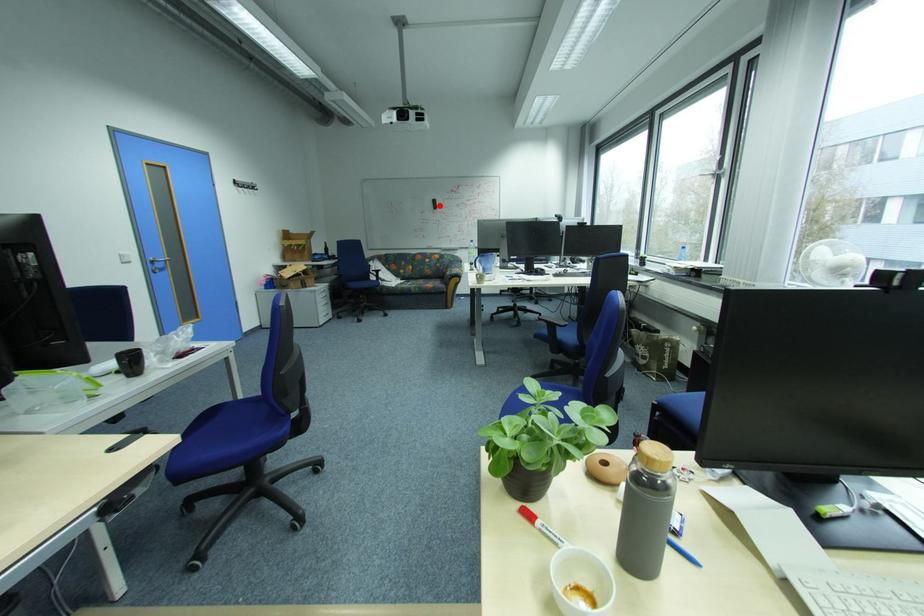
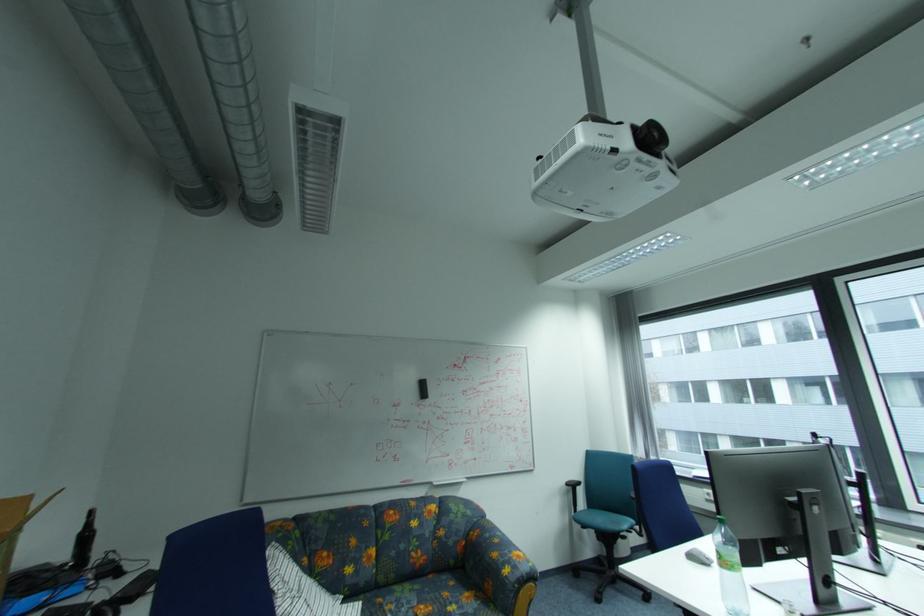
In the second image, find the point that corresponds to the highlighted location in the first image.

(423, 391)